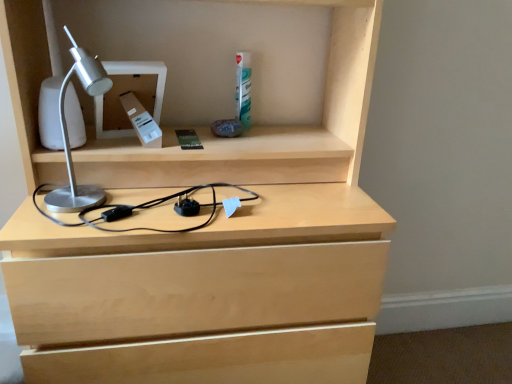
What is the approximate width of silver metallic desk lamp at left?

It is 5.78 inches.

Locate an element on the screen. silver metallic desk lamp at left is located at coordinates (68, 134).

The height and width of the screenshot is (384, 512). What do you see at coordinates (68, 134) in the screenshot?
I see `silver metallic desk lamp at left` at bounding box center [68, 134].

This screenshot has width=512, height=384. What do you see at coordinates (142, 74) in the screenshot? I see `silver metallic desk lamp at upper left` at bounding box center [142, 74].

Locate an element on the screen. The height and width of the screenshot is (384, 512). silver metallic desk lamp at upper left is located at coordinates (142, 74).

Find the location of `silver metallic desk lamp at left`. silver metallic desk lamp at left is located at coordinates (68, 134).

Based on the photo, considering the relative positions of silver metallic desk lamp at upper left and silver metallic desk lamp at left in the image provided, is silver metallic desk lamp at upper left to the left of silver metallic desk lamp at left from the viewer's perspective?

No.

Relative to silver metallic desk lamp at left, is silver metallic desk lamp at upper left in front or behind?

Clearly, silver metallic desk lamp at upper left is behind silver metallic desk lamp at left.

Is point (120, 65) farther from viewer compared to point (79, 47)?

No, it is in front of (79, 47).

From the image's perspective, which is below, silver metallic desk lamp at upper left or silver metallic desk lamp at left?

silver metallic desk lamp at left, from the image's perspective.

From a real-world perspective, is silver metallic desk lamp at upper left located beneath silver metallic desk lamp at left?

No, from a real-world perspective, silver metallic desk lamp at upper left is not beneath silver metallic desk lamp at left.

Which of these two, silver metallic desk lamp at upper left or silver metallic desk lamp at left, is wider?

silver metallic desk lamp at upper left is wider.

Considering the sizes of silver metallic desk lamp at upper left and silver metallic desk lamp at left in the image, is silver metallic desk lamp at upper left taller or shorter than silver metallic desk lamp at left?

Clearly, silver metallic desk lamp at upper left is shorter compared to silver metallic desk lamp at left.

Is silver metallic desk lamp at upper left smaller than silver metallic desk lamp at left?

Correct, silver metallic desk lamp at upper left occupies less space than silver metallic desk lamp at left.

Choose the correct answer: Is silver metallic desk lamp at upper left inside silver metallic desk lamp at left or outside it?

silver metallic desk lamp at upper left is spatially situated outside silver metallic desk lamp at left.

Is there a large distance between silver metallic desk lamp at upper left and silver metallic desk lamp at left?

No, there isn't a large distance between silver metallic desk lamp at upper left and silver metallic desk lamp at left.

Is silver metallic desk lamp at left at the back of silver metallic desk lamp at upper left?

No, silver metallic desk lamp at upper left's orientation is not away from silver metallic desk lamp at left.

What's the angular difference between silver metallic desk lamp at upper left and silver metallic desk lamp at left's facing directions?

They differ by 15 degrees in their facing directions.

How much distance is there between silver metallic desk lamp at upper left and silver metallic desk lamp at left?

They are 4.68 inches apart.

This screenshot has width=512, height=384. What are the coordinates of `lamp in front of the silver metallic desk lamp at upper left` in the screenshot? It's located at (68, 134).

Visually, is silver metallic desk lamp at left positioned to the left or to the right of silver metallic desk lamp at upper left?

In the image, silver metallic desk lamp at left appears on the left side of silver metallic desk lamp at upper left.

Is silver metallic desk lamp at left behind silver metallic desk lamp at upper left?

No, it is in front of silver metallic desk lamp at upper left.

Which point is more distant from viewer, (55, 210) or (115, 136)?

The point (115, 136) is farther from the camera.

From the image's perspective, is silver metallic desk lamp at left below silver metallic desk lamp at upper left?

Indeed, from the image's perspective, silver metallic desk lamp at left is shown beneath silver metallic desk lamp at upper left.

From a real-world perspective, which object stands above the other?

From a 3D spatial view, silver metallic desk lamp at upper left is above.

Does silver metallic desk lamp at left have a lesser width compared to silver metallic desk lamp at upper left?

Yes, silver metallic desk lamp at left is thinner than silver metallic desk lamp at upper left.

Does silver metallic desk lamp at left have a greater height compared to silver metallic desk lamp at upper left?

Yes, silver metallic desk lamp at left is taller than silver metallic desk lamp at upper left.

Can you confirm if silver metallic desk lamp at left is smaller than silver metallic desk lamp at upper left?

No.

Is silver metallic desk lamp at left inside the boundaries of silver metallic desk lamp at upper left, or outside?

silver metallic desk lamp at left lies outside silver metallic desk lamp at upper left.

Is silver metallic desk lamp at left touching silver metallic desk lamp at upper left?

No, silver metallic desk lamp at left is not with silver metallic desk lamp at upper left.

Is silver metallic desk lamp at left facing away from silver metallic desk lamp at upper left?

Correct, silver metallic desk lamp at left is looking away from silver metallic desk lamp at upper left.

Can you tell me how much silver metallic desk lamp at left and silver metallic desk lamp at upper left differ in facing direction?

The angular difference between silver metallic desk lamp at left and silver metallic desk lamp at upper left is 15 degrees.

You are a GUI agent. You are given a task and a screenshot of the screen. Output one action in this format:
    pyautogui.click(x=<x>, y=<y>)
    Task: Click on the cabinet behind the silver metallic desk lamp at left
    This screenshot has height=384, width=512.
    Given the screenshot: What is the action you would take?
    click(142, 74)

This screenshot has width=512, height=384. Identify the location of cabinet that appears on the right of silver metallic desk lamp at left. (142, 74).

Locate an element on the screen. The width and height of the screenshot is (512, 384). lamp on the left side of silver metallic desk lamp at upper left is located at coordinates (68, 134).